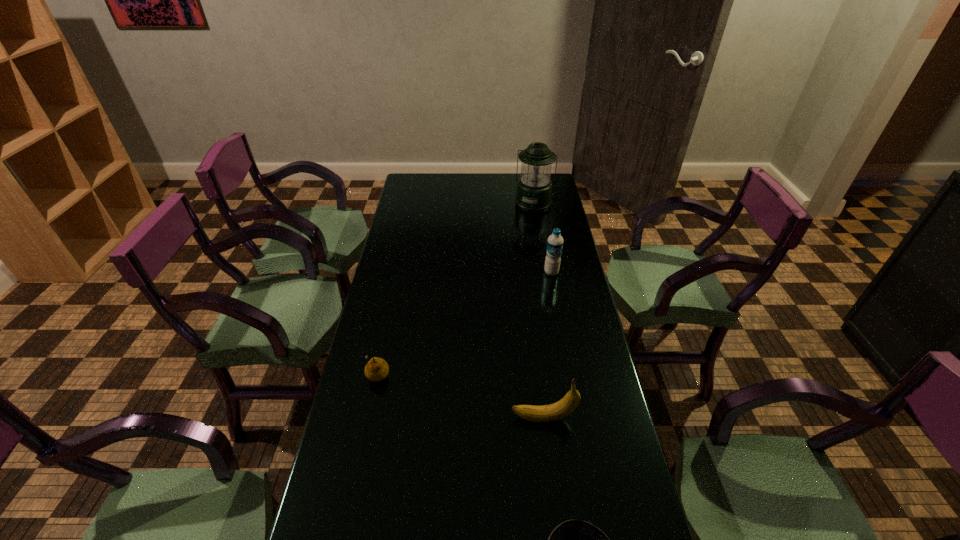
The width and height of the screenshot is (960, 540). In order to click on free space at the far right corner of the desktop in this screenshot , I will do `click(555, 196)`.

Find the location of `vacant space that's between the banana and the leftmost object`. vacant space that's between the banana and the leftmost object is located at coordinates (461, 396).

Find the location of a particular element. Image resolution: width=960 pixels, height=540 pixels. unoccupied area between the banana and the third nearest object is located at coordinates (461, 396).

Where is `unoccupied area between the second nearest object and the farthest object`? unoccupied area between the second nearest object and the farthest object is located at coordinates (539, 311).

You are a GUI agent. You are given a task and a screenshot of the screen. Output one action in this format:
    pyautogui.click(x=<x>, y=<y>)
    Task: Click on the vacant area that lies between the second farthest object and the lantern
    The image size is (960, 540).
    Given the screenshot: What is the action you would take?
    pyautogui.click(x=542, y=238)

You are a GUI agent. You are given a task and a screenshot of the screen. Output one action in this format:
    pyautogui.click(x=<x>, y=<y>)
    Task: Click on the vacant point located between the banana and the farthest object
    
    Given the screenshot: What is the action you would take?
    pyautogui.click(x=539, y=311)

Identify which object is the third nearest to the nearest object. Please provide its 2D coordinates. Your answer should be formatted as a tuple, i.e. [(x, y)], where the tuple contains the x and y coordinates of a point satisfying the conditions above.

[(555, 241)]

Point out which object is positioned as the second nearest to the tallest object. Please provide its 2D coordinates. Your answer should be formatted as a tuple, i.e. [(x, y)], where the tuple contains the x and y coordinates of a point satisfying the conditions above.

[(377, 369)]

Where is `vacant space that satisfies the following two spatial constraints: 1. on the front side of the lantern; 2. at the start of the peel on the second nearest object`? Image resolution: width=960 pixels, height=540 pixels. vacant space that satisfies the following two spatial constraints: 1. on the front side of the lantern; 2. at the start of the peel on the second nearest object is located at coordinates 570,418.